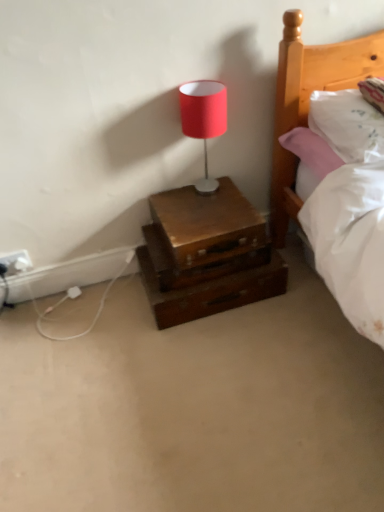
Where is `white plastic electric outlet at lower left`? white plastic electric outlet at lower left is located at coordinates (16, 261).

What do you see at coordinates (351, 242) in the screenshot?
I see `white soft mattress at lower right` at bounding box center [351, 242].

Where is `white plastic electric outlet at lower left`? The width and height of the screenshot is (384, 512). white plastic electric outlet at lower left is located at coordinates (16, 261).

Is matte red lampshade at upper center oriented towards white soft pillow at upper right?

No, matte red lampshade at upper center is not aimed at white soft pillow at upper right.

Is the position of matte red lampshade at upper center less distant than that of white soft pillow at upper right?

No, matte red lampshade at upper center is behind white soft pillow at upper right.

Between matte red lampshade at upper center and white soft pillow at upper right, which one has larger width?

white soft pillow at upper right.

Identify the location of mattress that appears below the white soft pillow at upper right (from a real-world perspective). Image resolution: width=384 pixels, height=512 pixels. (351, 242).

Does point (340, 264) appear closer or farther from the camera than point (344, 144)?

Point (340, 264) is closer to the camera than point (344, 144).

Would you say white soft mattress at lower right is inside or outside white soft pillow at upper right?

white soft mattress at lower right cannot be found inside white soft pillow at upper right.

Which is in front, point (365, 153) or point (224, 118)?

The point (365, 153) is in front.

Based on the photo, from the image's perspective, would you say white soft pillow at upper right is shown under matte red lampshade at upper center?

Incorrect, from the image's perspective, white soft pillow at upper right is higher than matte red lampshade at upper center.

Is white soft pillow at upper right not close to matte red lampshade at upper center?

No, there isn't a large distance between white soft pillow at upper right and matte red lampshade at upper center.

Is white soft pillow at upper right positioned with its back to matte red lampshade at upper center?

white soft pillow at upper right is not turned away from matte red lampshade at upper center.

Does point (314, 106) lie behind point (16, 268)?

No.

From a real-world perspective, who is located lower, white soft pillow at upper right or white plastic electric outlet at lower left?

white plastic electric outlet at lower left, from a real-world perspective.

From the image's perspective, between white soft pillow at upper right and white plastic electric outlet at lower left, who is located below?

white plastic electric outlet at lower left, from the image's perspective.

Is white soft pillow at upper right completely or partially outside of white plastic electric outlet at lower left?

That's correct, white soft pillow at upper right is outside of white plastic electric outlet at lower left.

Between white soft pillow at upper right and wooden chest at lower center, which one has smaller width?

wooden chest at lower center is thinner.

In the scene shown: Does white soft pillow at upper right turn towards wooden chest at lower center?

No, white soft pillow at upper right is not aimed at wooden chest at lower center.

Which of these two, white soft pillow at upper right or wooden chest at lower center, stands shorter?

wooden chest at lower center.

Which is in front, wooden nightstand at center or matte red lampshade at upper center?

matte red lampshade at upper center is in front.

From the image's perspective, between wooden nightstand at center and matte red lampshade at upper center, who is located below?

wooden nightstand at center, from the image's perspective.

Could you tell me if wooden nightstand at center is facing matte red lampshade at upper center?

No, wooden nightstand at center is not oriented towards matte red lampshade at upper center.

Between wooden nightstand at center and matte red lampshade at upper center, which one has larger width?

Wider between the two is wooden nightstand at center.

Identify the location of nightstand below the white plastic electric outlet at lower left (from a real-world perspective). The height and width of the screenshot is (512, 384). (206, 254).

How many degrees apart are the facing directions of wooden nightstand at center and white plastic electric outlet at lower left?

There is a 1.13-degree angle between the facing directions of wooden nightstand at center and white plastic electric outlet at lower left.

How distant is wooden nightstand at center from white plastic electric outlet at lower left?

They are 29.61 inches apart.

Between wooden nightstand at center and white plastic electric outlet at lower left, which one appears on the right side from the viewer's perspective?

From the viewer's perspective, wooden nightstand at center appears more on the right side.

Where is `pillow located above the matte red lampshade at upper center (from a real-world perspective)`? The image size is (384, 512). pillow located above the matte red lampshade at upper center (from a real-world perspective) is located at coordinates (348, 124).

Locate an element on the screen. This screenshot has height=512, width=384. mattress behind the white soft pillow at upper right is located at coordinates (351, 242).

Looking at the image, which one is located closer to white soft pillow at upper right, white soft mattress at lower right or wooden chest at lower center?

white soft mattress at lower right.

Which object lies further to the anchor point wooden nightstand at center, matte red lampshade at upper center or white soft pillow at upper right?

Among the two, white soft pillow at upper right is located further to wooden nightstand at center.

Consider the image. Looking at the image, which one is located closer to white soft pillow at upper right, wooden nightstand at center or white plastic electric outlet at lower left?

wooden nightstand at center is closer to white soft pillow at upper right.

Consider the image. Which object lies nearer to the anchor point white soft pillow at upper right, wooden chest at lower center or white soft mattress at lower right?

white soft mattress at lower right is closer to white soft pillow at upper right.

Considering their positions, is wooden chest at lower center positioned further to white soft pillow at upper right than matte red lampshade at upper center?

Among the two, wooden chest at lower center is located further to white soft pillow at upper right.

In the scene shown: Estimate the real-world distances between objects in this image. Which object is closer to wooden nightstand at center, white plastic electric outlet at lower left or wooden chest at lower center?

wooden chest at lower center is positioned closer to the anchor wooden nightstand at center.

Estimate the real-world distances between objects in this image. Which object is further from matte red lampshade at upper center, white plastic electric outlet at lower left or wooden nightstand at center?

The object further to matte red lampshade at upper center is white plastic electric outlet at lower left.

Which object lies further to the anchor point white soft mattress at lower right, white plastic electric outlet at lower left or wooden nightstand at center?

The object further to white soft mattress at lower right is white plastic electric outlet at lower left.

Find the location of a particular element. The width and height of the screenshot is (384, 512). mattress located between wooden chest at lower center and white soft pillow at upper right in the left-right direction is located at coordinates (351, 242).

At what (x,y) coordinates should I click in order to perform the action: click on nightstand between wooden chest at lower center and white soft pillow at upper right in the horizontal direction. Please return your answer as a coordinate pair (x, y). Looking at the image, I should click on (206, 254).

Where is `nightstand located between wooden chest at lower center and white soft mattress at lower right in the left-right direction`? nightstand located between wooden chest at lower center and white soft mattress at lower right in the left-right direction is located at coordinates (206, 254).

The image size is (384, 512). I want to click on the chest located between white plastic electric outlet at lower left and white soft mattress at lower right in the left-right direction, so click(x=207, y=224).